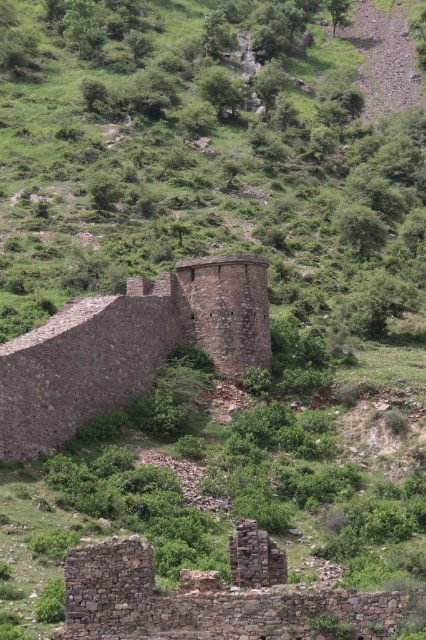
Question: Is brown stone wall at center to the left of rusty stone ruins at lower left from the viewer's perspective?

Choices:
 (A) no
 (B) yes

Answer: (B)

Question: Can you confirm if brown stone wall at center is positioned above rusty stone ruins at lower left?

Choices:
 (A) yes
 (B) no

Answer: (A)

Question: Is brown stone wall at center wider than rusty stone ruins at lower left?

Choices:
 (A) no
 (B) yes

Answer: (B)